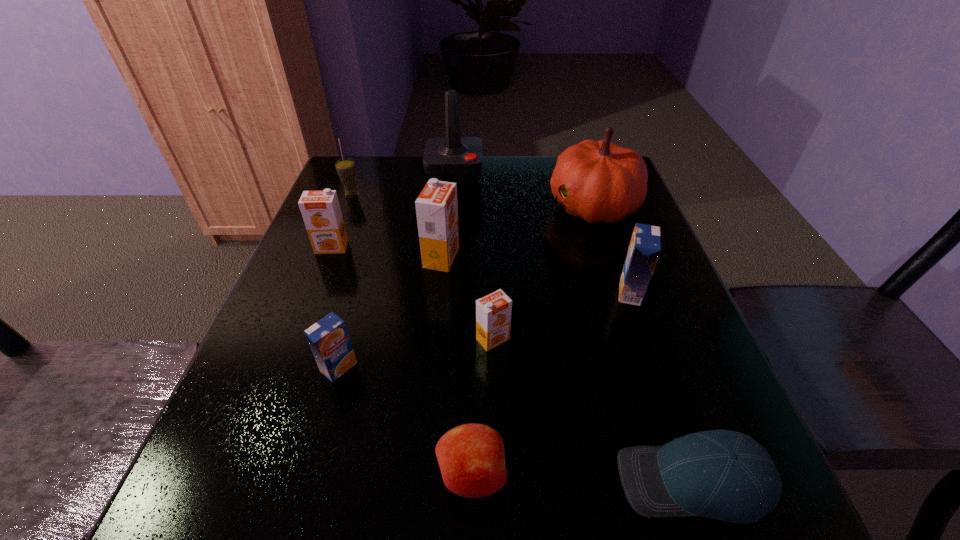
Image resolution: width=960 pixels, height=540 pixels. In order to click on object situated at the near right corner in this screenshot , I will do `click(725, 475)`.

The width and height of the screenshot is (960, 540). Identify the location of vacant region at the far edge of the desktop. coord(549,191).

This screenshot has height=540, width=960. In the image, there is a desktop. What are the coordinates of `free region at the right edge` in the screenshot? It's located at (700, 357).

Find the location of a particular element. blank area at the far left corner is located at coordinates (361, 181).

Identify the location of free space at the near right corner of the desktop. The width and height of the screenshot is (960, 540). (784, 518).

The height and width of the screenshot is (540, 960). I want to click on vacant area that lies between the pink pumpkin and the nearest orange orange juice, so click(543, 272).

Where is `free space between the red apple and the third object from left to right`? free space between the red apple and the third object from left to right is located at coordinates (405, 421).

Locate an element on the screen. This screenshot has height=540, width=960. empty space between the third tallest object and the straw for drinking is located at coordinates (396, 226).

At what (x,y) coordinates should I click in order to perform the action: click on free spot between the light baseball cap and the left blue orange_juice. Please return your answer as a coordinate pair (x, y). The image size is (960, 540). Looking at the image, I should click on (516, 424).

In order to click on vacant area that lies between the yellow straw for drinking and the pumpkin in this screenshot , I will do (472, 200).